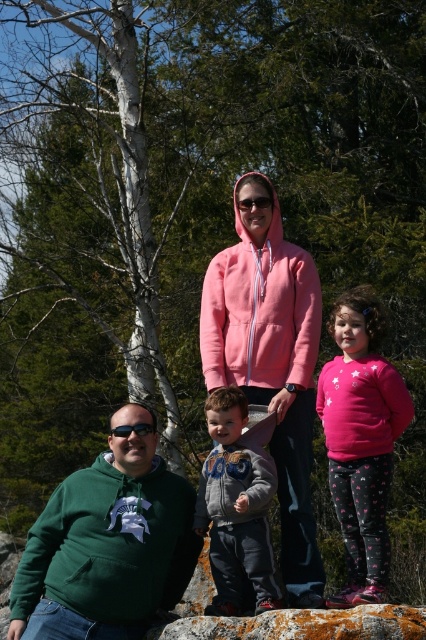
Is pink fleece hoodie at center bigger than rusty rock at center?

Indeed, pink fleece hoodie at center has a larger size compared to rusty rock at center.

Between point (267, 188) and point (371, 621), which one is positioned in front?

Point (371, 621)

Which is behind, point (287, 259) or point (196, 632)?

The point (287, 259) is behind.

Identify the location of pink fleece hoodie at center. (270, 358).

Measure the distance between green fleece sweatshirt at center and olive-green fleece jacket at center.

green fleece sweatshirt at center is 18.77 inches away from olive-green fleece jacket at center.

Is green fleece sweatshirt at center to the left of olive-green fleece jacket at center from the viewer's perspective?

Indeed, green fleece sweatshirt at center is positioned on the left side of olive-green fleece jacket at center.

What do you see at coordinates (108, 545) in the screenshot? The height and width of the screenshot is (640, 426). I see `green fleece sweatshirt at center` at bounding box center [108, 545].

Find the location of a particular element. The image size is (426, 640). green fleece sweatshirt at center is located at coordinates (108, 545).

Is point (282, 250) farther from camera compared to point (152, 426)?

That is True.

Who is more forward, (x=247, y=376) or (x=141, y=426)?

Point (x=141, y=426)

This screenshot has width=426, height=640. Identify the location of pink fleece sweatshirt at center. (259, 310).